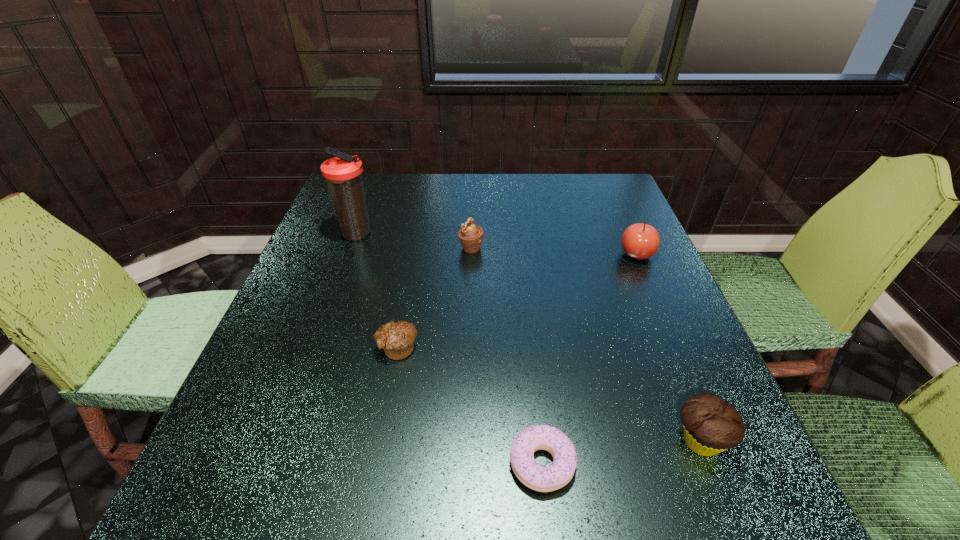
The height and width of the screenshot is (540, 960). Identify the location of free space that satisfies the following two spatial constraints: 1. on the back side of the apple; 2. on the left side of the shortest object. pyautogui.click(x=519, y=254).